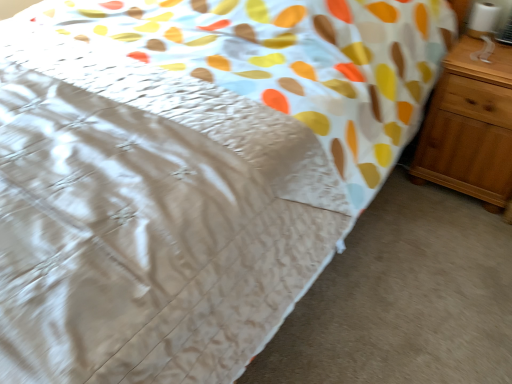
At what (x,y) coordinates should I click in order to perform the action: click on vacant space situated above wooden nightstand at right (from a real-world perspective). Please return your answer as a coordinate pair (x, y). Image resolution: width=512 pixels, height=384 pixels. Looking at the image, I should click on (488, 56).